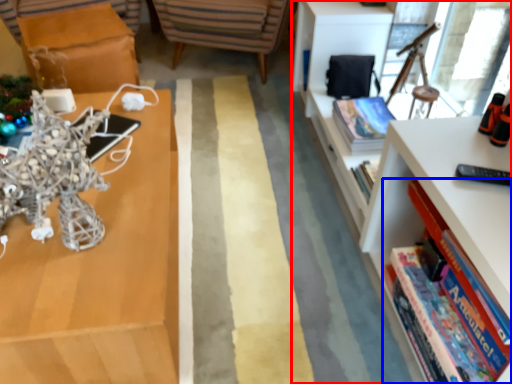
Question: Among these objects, which one is nearest to the camera, bookcase (highlighted by a red box) or book (highlighted by a blue box)?

Choices:
 (A) bookcase
 (B) book

Answer: (A)